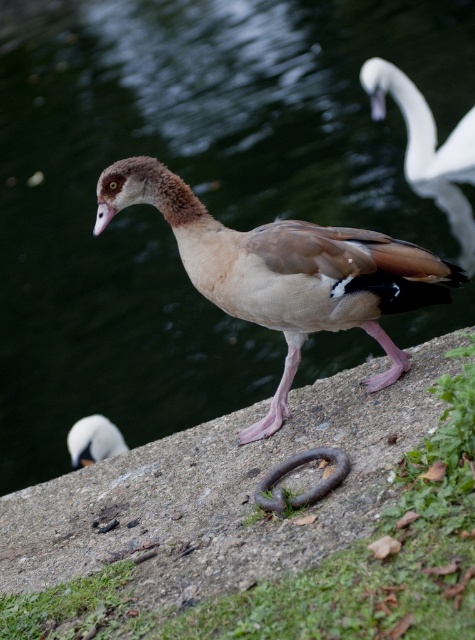
You are a wildlife photographer trying to capture a close shot of the brown feathered duck at center and the brown rubber ring at lower center. Since your camera has a limited field of view, you need to know which object is wider. Which one is wider?

The brown feathered duck at center is wider than the brown rubber ring at lower center.

Consider the image. You are a photographer trying to capture both the white glossy swan at upper right and the brown rubber ring at lower center in the same frame. Based on their sizes, which object should you zoom in on to ensure both are visible without cropping?

The white glossy swan at upper right is larger than the brown rubber ring at lower center, so you should zoom out to include both in the frame without cropping.